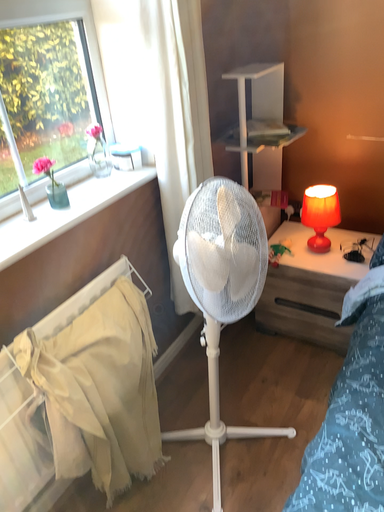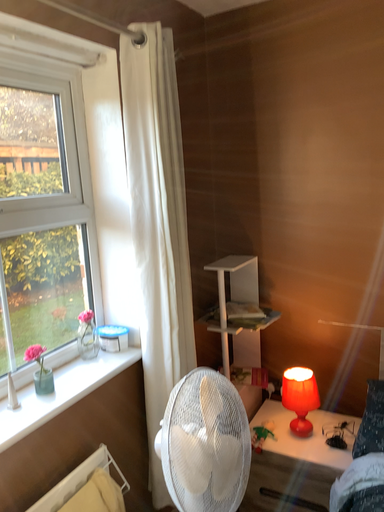
Question: Which way did the camera rotate in the video?

Choices:
 (A) rotated downward
 (B) rotated upward

Answer: (B)